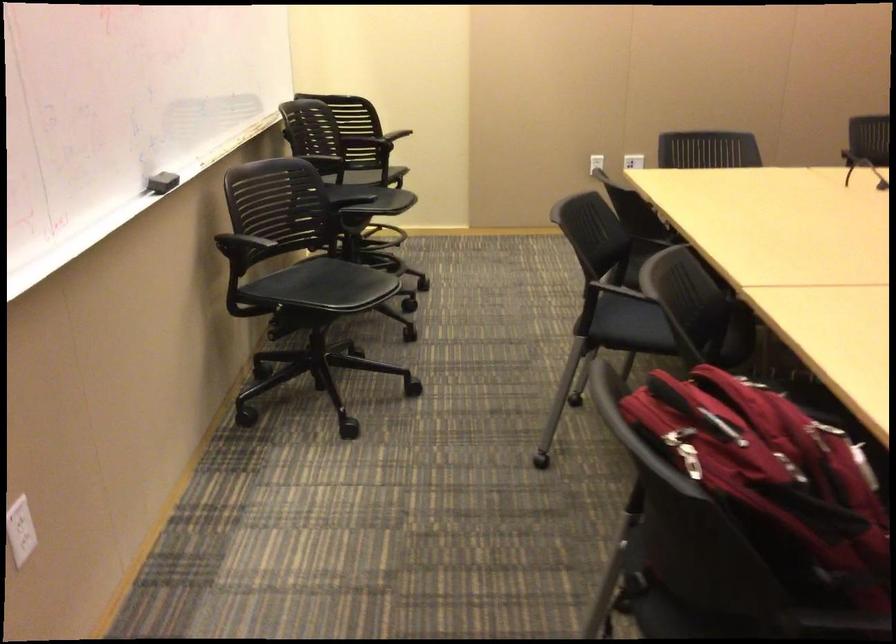
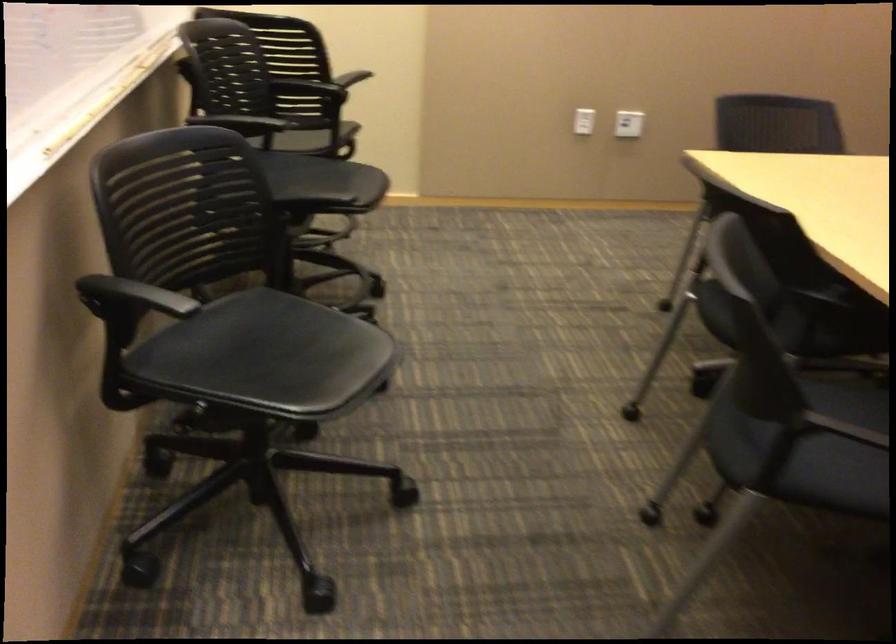
Where in the second image is the point corresponding to pixel 645 327 from the first image?

(804, 442)